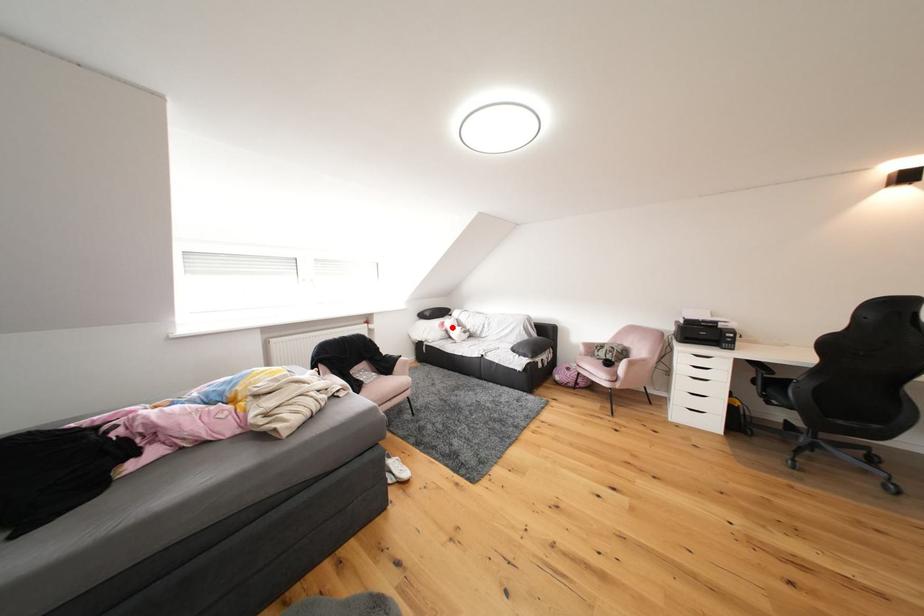
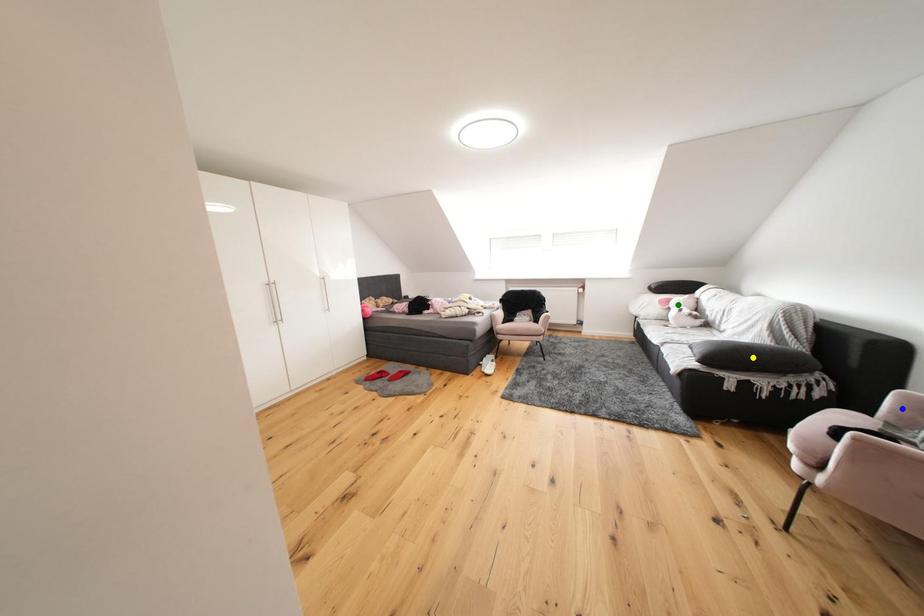
Question: I am providing you with two images of the same scene from different viewpoints. A red point is marked on the first image. You are given multiple points on the second image. Which spot in image 2 lines up with the point in image 1?

Choices:
 (A) blue point
 (B) green point
 (C) yellow point

Answer: (B)